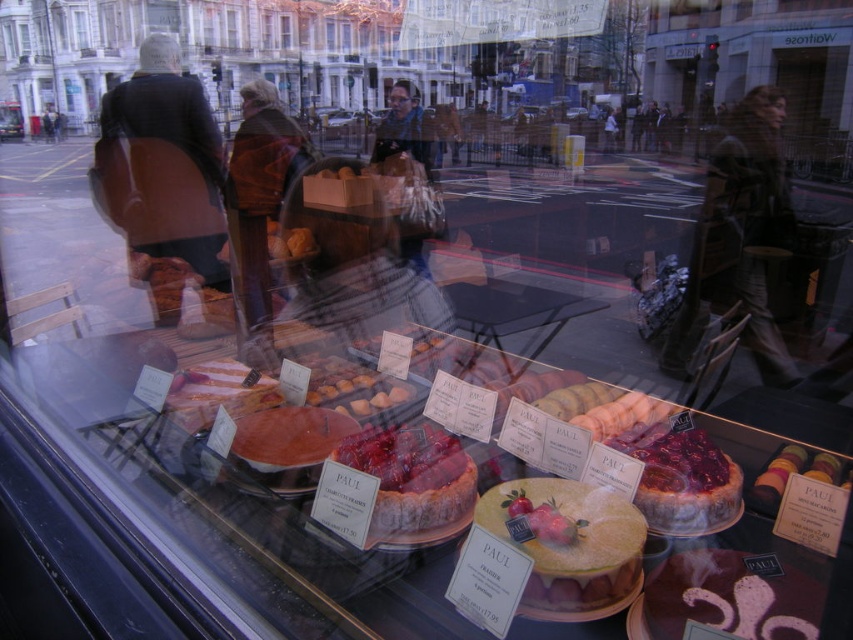
You are a customer looking through the bakery window. You see two points inside the display case. One is at coordinate point (720, 512) and the other at point (325, 449). Which point is closer to you?

Point (720, 512) is closer to the camera than point (325, 449).

You are a customer looking at the bakery display through the window. You see the glazed raspberry cheesecake at center and the smooth pink cake at center. Which one is taller?

The glazed raspberry cheesecake at center is taller than the smooth pink cake at center.

You are a customer looking at the bakery display through the window. You notice the multicolored macarons at center. Where exactly are they positioned in the display case?

The multicolored macarons at center are located at point coordinates of 0.738 on the x axis and 0.932 on the y axis.